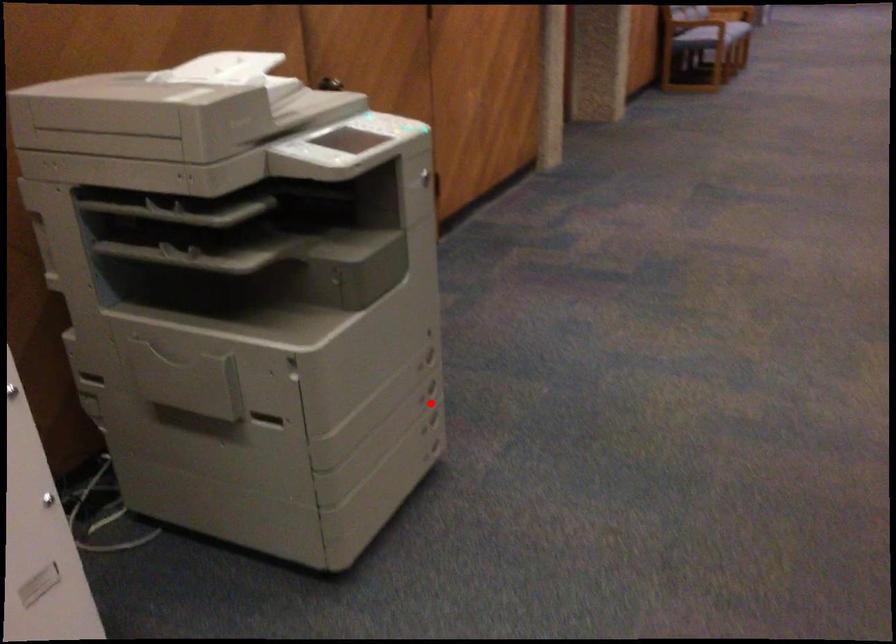
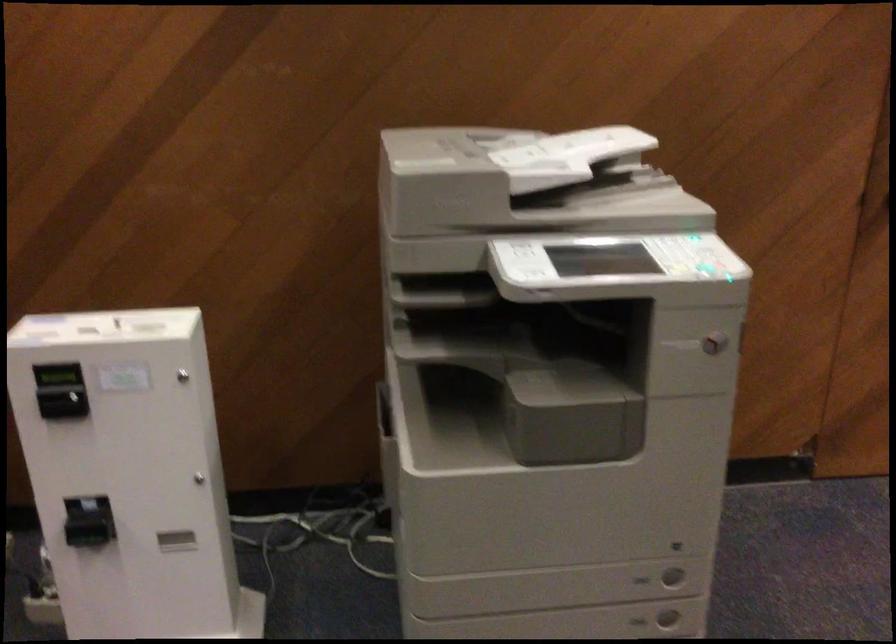
Find the pixel in the second image that matches the highlighted location in the first image.

(638, 621)